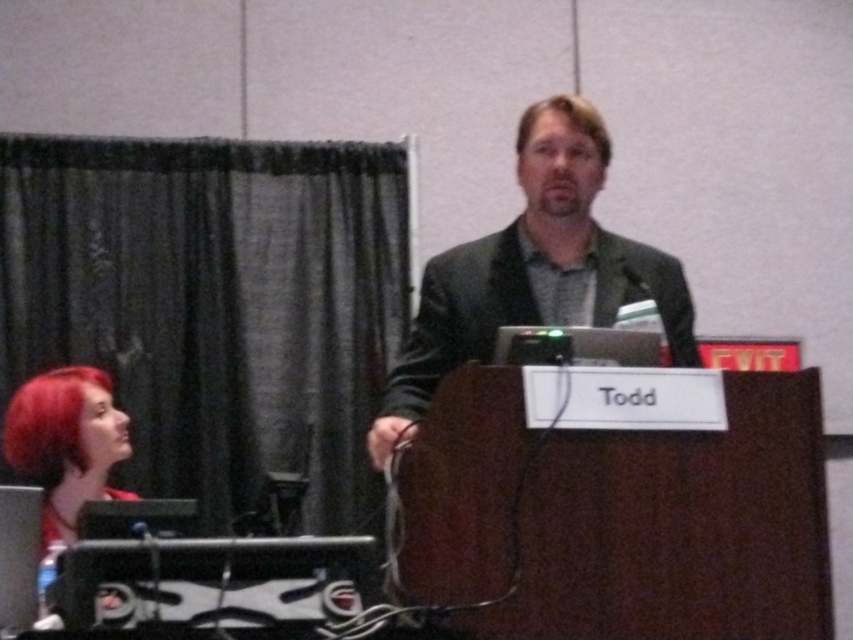
You are standing at the back of the room and want to check if the distance between the dark gray suit at center and the blonde hair at center is enough to walk through. Can you confirm if the space is at least 12 inches wide?

The dark gray suit at center is 11.94 inches away from the blonde hair at center, so the space is slightly less than 12 inches wide. It might be tight, but you could still walk through if careful.

You are an event coordinator checking the seating arrangement. You notice two attendees with distinct hair colors in the front row. Which attendee has a larger head size between the shiny red hair at lower left and the blonde hair at center?

The shiny red hair at lower left is larger in size than the blonde hair at center, so the attendee with shiny red hair at lower left has a larger head size.